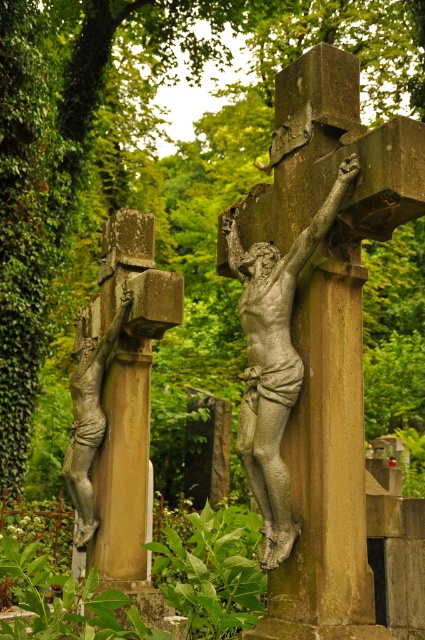
Question: Considering the real-world distances, which object is closest to the silver textured crucifix at center?

Choices:
 (A) bronze statue at left
 (B) bronze statue of crucifixion figure at left
 (C) brown stone crucifix at center

Answer: (C)

Question: Which point is closer to the camera?

Choices:
 (A) (99, 340)
 (B) (283, 355)

Answer: (B)

Question: Does brown stone crucifix at center have a lesser width compared to bronze statue of crucifixion figure at left?

Choices:
 (A) no
 (B) yes

Answer: (A)

Question: Is silver textured crucifix at center to the right of bronze statue of crucifixion figure at left from the viewer's perspective?

Choices:
 (A) no
 (B) yes

Answer: (B)

Question: Does silver textured crucifix at center have a greater width compared to bronze statue of crucifixion figure at left?

Choices:
 (A) yes
 (B) no

Answer: (A)

Question: Which point appears farthest from the camera in this image?

Choices:
 (A) (127, 524)
 (B) (104, 353)
 (C) (289, 531)
 (D) (277, 625)

Answer: (B)